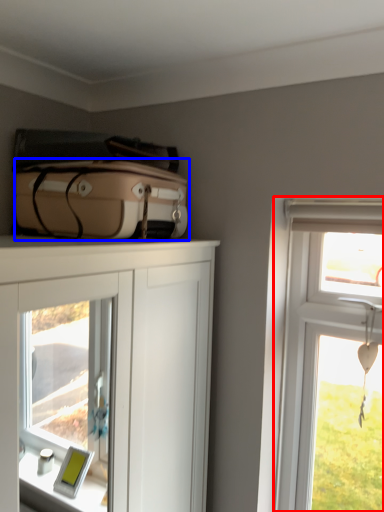
Question: Which point is closer to the camera, window (highlighted by a red box) or suitcase (highlighted by a blue box)?

Choices:
 (A) window
 (B) suitcase

Answer: (B)